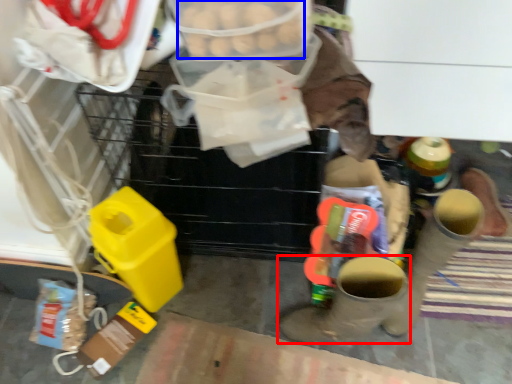
Question: Which of the following is the closest to the observer, footwear (highlighted by a red box) or food (highlighted by a blue box)?

Choices:
 (A) footwear
 (B) food

Answer: (B)